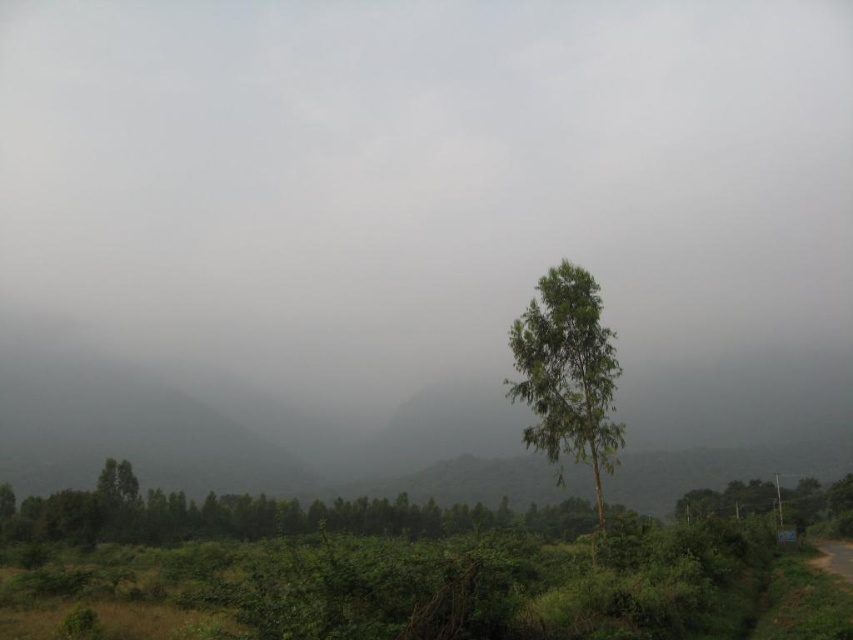
Question: Is green leafy tree at center to the right of green leafy tree at lower right from the viewer's perspective?

Choices:
 (A) no
 (B) yes

Answer: (A)

Question: Is green leafy tree at center above green leafy tree at lower right?

Choices:
 (A) no
 (B) yes

Answer: (B)

Question: Is the position of green leafy tree at center more distant than that of green leafy tree at lower right?

Choices:
 (A) yes
 (B) no

Answer: (B)